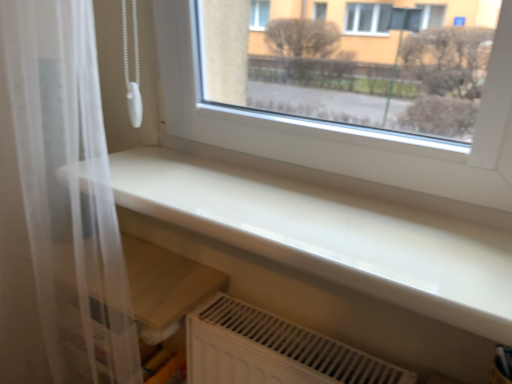
Question: Looking at their shapes, would you say white glossy counter top at lower center is wider or thinner than white plastic radiator at lower center?

Choices:
 (A) thin
 (B) wide

Answer: (B)

Question: From a real-world perspective, is white glossy counter top at lower center physically located above or below white plastic radiator at lower center?

Choices:
 (A) below
 (B) above

Answer: (B)

Question: Which object is positioned farthest from the white plastic radiator at lower center?

Choices:
 (A) white glossy counter top at lower center
 (B) white sheer curtain at left

Answer: (B)

Question: Which is farther from the white sheer curtain at left?

Choices:
 (A) white plastic radiator at lower center
 (B) white glossy counter top at lower center

Answer: (A)